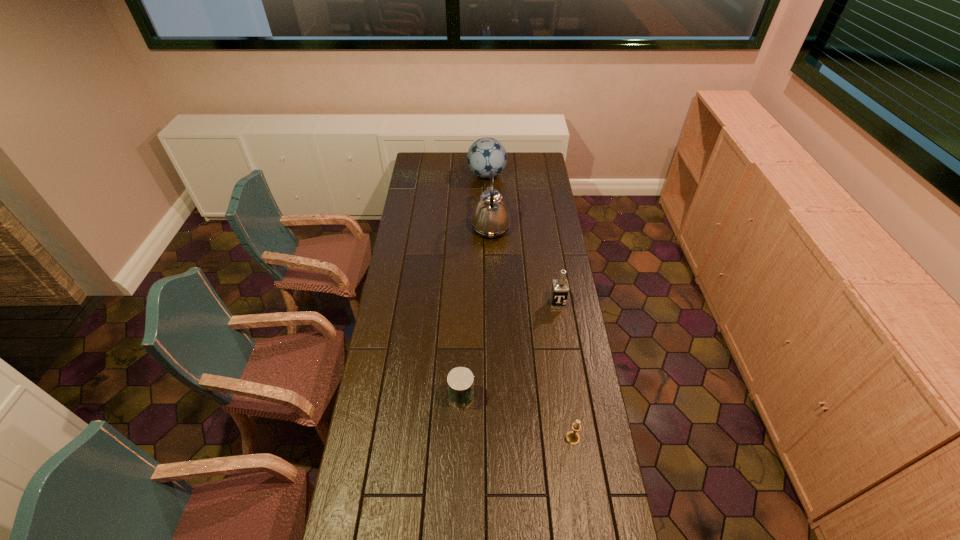
This screenshot has height=540, width=960. Identify the location of vacant space at the right edge of the desktop. coord(532,236).

At what (x,y) coordinates should I click in order to perform the action: click on free area in between the can and the candle holder. Please return your answer as a coordinate pair (x, y). The width and height of the screenshot is (960, 540). Looking at the image, I should click on (517, 417).

You are a GUI agent. You are given a task and a screenshot of the screen. Output one action in this format:
    pyautogui.click(x=<x>, y=<y>)
    Task: Click on the vacant space in between the third shortest object and the nearest object
    The height and width of the screenshot is (540, 960).
    Given the screenshot: What is the action you would take?
    pyautogui.click(x=565, y=371)

Where is `free space between the nearest object and the third tallest object`? free space between the nearest object and the third tallest object is located at coordinates (565, 371).

Identify the location of empty location between the farthest object and the candle holder. The width and height of the screenshot is (960, 540). (530, 307).

In order to click on vacant space in between the candle holder and the second farthest object in this screenshot , I will do `click(532, 333)`.

At what (x,y) coordinates should I click in order to perform the action: click on free spot between the tallest object and the vodka. Please return your answer as a coordinate pair (x, y). The height and width of the screenshot is (540, 960). Looking at the image, I should click on (524, 266).

Identify which object is the third nearest to the candle holder. Please provide its 2D coordinates. Your answer should be formatted as a tuple, i.e. [(x, y)], where the tuple contains the x and y coordinates of a point satisfying the conditions above.

[(490, 218)]

Find the location of a particular element. object that is the fourth closest to the kettle is located at coordinates (572, 437).

Where is `vacant space that satisfies the following two spatial constraints: 1. on the side with brand of the farthest object; 2. on the left side of the candle holder`? The width and height of the screenshot is (960, 540). vacant space that satisfies the following two spatial constraints: 1. on the side with brand of the farthest object; 2. on the left side of the candle holder is located at coordinates (492, 438).